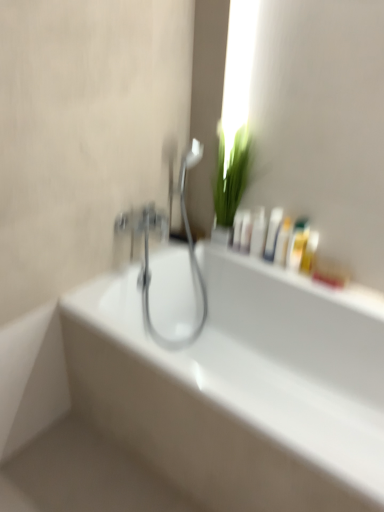
Question: Considering the positions of white glossy bottle at upper right, arranged as the 1th mouthwash when viewed from the left, and green leafy plant at upper center in the image, is white glossy bottle at upper right, arranged as the 1th mouthwash when viewed from the left, taller or shorter than green leafy plant at upper center?

Choices:
 (A) short
 (B) tall

Answer: (A)

Question: In the image, is white glossy bottle at upper right, arranged as the 1th mouthwash when viewed from the left, positioned in front of or behind green leafy plant at upper center?

Choices:
 (A) behind
 (B) front

Answer: (A)

Question: Which object is positioned closest to the white glossy bottle at upper center, which appears as the sixth mouthwash when viewed from the right?

Choices:
 (A) white glossy bathtub at center
 (B) green leafy plant at upper center
 (C) white glossy bottle at upper right, the fourth mouthwash in the right-to-left sequence
 (D) white glossy bottle at upper right, which is the third mouthwash from right to left
 (E) yellow plastic bottle at upper right, which is counted as the 7th mouthwash, starting from the left

Answer: (C)

Question: Which is farther from the white glossy bottles at upper center?

Choices:
 (A) white glossy bottle at upper center, the 2th mouthwash positioned from the left
 (B) polished chrome faucet at center
 (C) white glossy bottle at upper right, which ranks as the fifth mouthwash in left-to-right order
 (D) green leafy plant at upper center
 (E) translucent plastic bottle at upper right, the 2th mouthwash in the right-to-left sequence

Answer: (B)